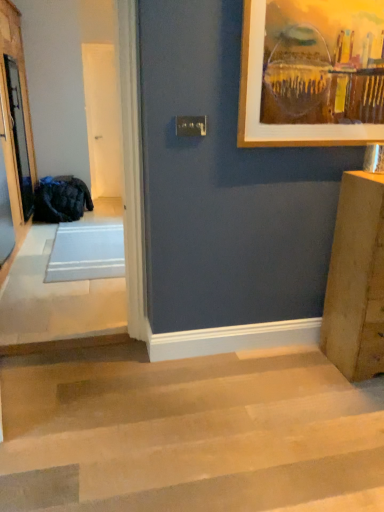
Question: Is dark blue fabric bag at left closer to camera compared to clear glass screen door at left, which is counted as the second screen door, starting from the back?

Choices:
 (A) no
 (B) yes

Answer: (A)

Question: Is dark blue fabric bag at left in contact with clear glass screen door at left, which is counted as the second screen door, starting from the back?

Choices:
 (A) yes
 (B) no

Answer: (B)

Question: Is dark blue fabric bag at left wider than clear glass screen door at left, the 1th screen door from the left?

Choices:
 (A) no
 (B) yes

Answer: (B)

Question: Can you confirm if dark blue fabric bag at left is taller than clear glass screen door at left, the 1th screen door from the left?

Choices:
 (A) no
 (B) yes

Answer: (A)

Question: Is dark blue fabric bag at left shorter than clear glass screen door at left, which is counted as the second screen door, starting from the back?

Choices:
 (A) no
 (B) yes

Answer: (B)

Question: From a real-world perspective, is dark blue fabric bag at left physically above clear glass screen door at left, which appears as the 1th screen door when viewed from the front?

Choices:
 (A) yes
 (B) no

Answer: (B)

Question: Does clear glass screen door at left, which is counted as the second screen door, starting from the back, have a greater width compared to white glossy door at center, the 2th screen door when ordered from front to back?

Choices:
 (A) yes
 (B) no

Answer: (A)

Question: From the image's perspective, would you say clear glass screen door at left, which is counted as the second screen door, starting from the back, is positioned over white glossy door at center, the 2th screen door when ordered from left to right?

Choices:
 (A) no
 (B) yes

Answer: (A)

Question: Does clear glass screen door at left, which is counted as the second screen door, starting from the back, have a larger size compared to white glossy door at center, the 2th screen door when ordered from left to right?

Choices:
 (A) no
 (B) yes

Answer: (B)

Question: Does clear glass screen door at left, which is counted as the second screen door, starting from the back, appear on the right side of white glossy door at center, the 2th screen door when ordered from left to right?

Choices:
 (A) no
 (B) yes

Answer: (A)

Question: Is clear glass screen door at left, which is counted as the second screen door, starting from the back, completely or partially outside of white glossy door at center, marked as the first screen door in a right-to-left arrangement?

Choices:
 (A) no
 (B) yes

Answer: (B)

Question: Does clear glass screen door at left, the 1th screen door from the left, appear on the left side of white glossy door at center, the 2th screen door when ordered from left to right?

Choices:
 (A) no
 (B) yes

Answer: (B)

Question: Can we say white glossy door at center, marked as the 1th screen door in a back-to-front arrangement, lies outside light brown wooden stairs at lower left?

Choices:
 (A) yes
 (B) no

Answer: (A)